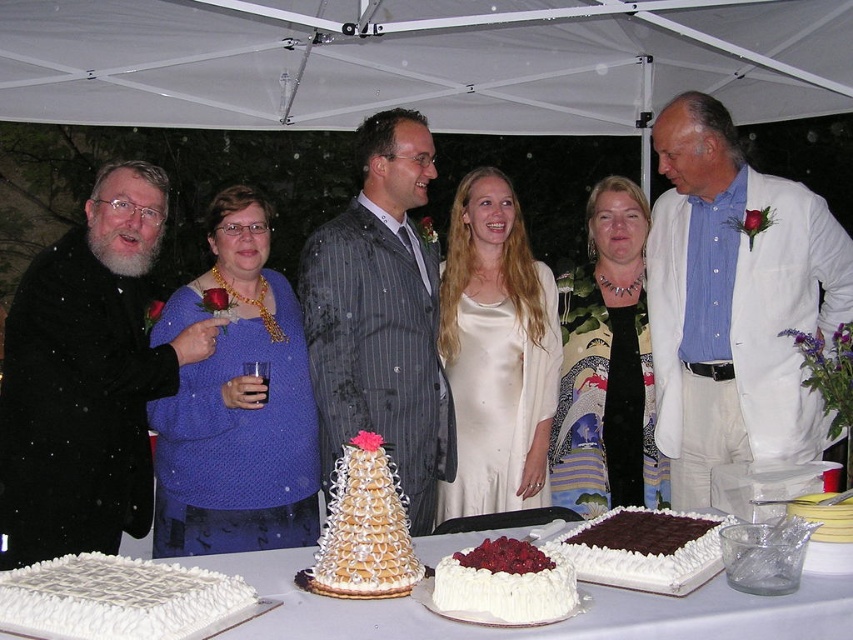
Does white fabric canopy at upper center appear under white textured cake at lower left?

Incorrect, white fabric canopy at upper center is not positioned below white textured cake at lower left.

Is white fabric canopy at upper center positioned at the back of white textured cake at lower left?

Yes, it is behind white textured cake at lower left.

The width and height of the screenshot is (853, 640). What do you see at coordinates (418, 61) in the screenshot?
I see `white fabric canopy at upper center` at bounding box center [418, 61].

The height and width of the screenshot is (640, 853). In order to click on white fabric canopy at upper center in this screenshot , I will do `click(418, 61)`.

Between white fabric canopy at upper center and white frosted cake at center, which one has less height?

white frosted cake at center is shorter.

Does white fabric canopy at upper center have a greater height compared to white frosted cake at center?

Correct, white fabric canopy at upper center is much taller as white frosted cake at center.

You are a GUI agent. You are given a task and a screenshot of the screen. Output one action in this format:
    pyautogui.click(x=<x>, y=<y>)
    Task: Click on the white fabric canopy at upper center
    
    Given the screenshot: What is the action you would take?
    pyautogui.click(x=418, y=61)

I want to click on white fabric canopy at upper center, so click(418, 61).

Is white fabric canopy at upper center to the left of printed silk scarf at center from the viewer's perspective?

Correct, you'll find white fabric canopy at upper center to the left of printed silk scarf at center.

Is white fabric canopy at upper center to the right of printed silk scarf at center from the viewer's perspective?

No, white fabric canopy at upper center is not to the right of printed silk scarf at center.

Is point (294, 58) less distant than point (618, 332)?

No.

At what (x,y) coordinates should I click in order to perform the action: click on white fabric canopy at upper center. Please return your answer as a coordinate pair (x, y). The height and width of the screenshot is (640, 853). Looking at the image, I should click on (418, 61).